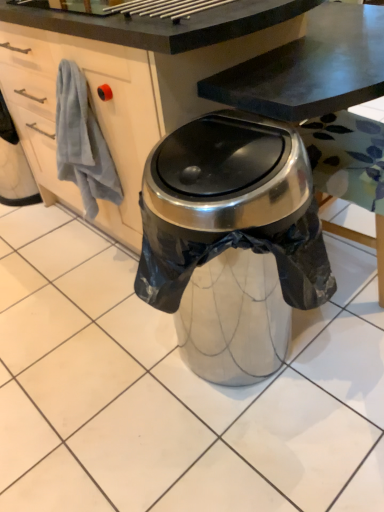
Describe the element at coordinates (174, 390) in the screenshot. I see `metallic trash can at center` at that location.

Identify the location of metallic trash can at center. 174,390.

What do you see at coordinates (94, 109) in the screenshot? Image resolution: width=384 pixels, height=512 pixels. I see `white matte cabinet at left` at bounding box center [94, 109].

The height and width of the screenshot is (512, 384). Find the location of `white matte cabinet at left`. white matte cabinet at left is located at coordinates (94, 109).

You are a GUI agent. You are given a task and a screenshot of the screen. Output one action in this format:
    pyautogui.click(x=<x>, y=<y>)
    Task: Click on the metallic trash can at center
    
    Given the screenshot: What is the action you would take?
    pyautogui.click(x=174, y=390)

Is white matte cabinet at left to the left or to the right of metallic trash can at center in the image?

Based on their positions, white matte cabinet at left is located to the left of metallic trash can at center.

Considering their positions, is white matte cabinet at left located in front of or behind metallic trash can at center?

Visually, white matte cabinet at left is located behind metallic trash can at center.

Does point (47, 113) come farther from viewer compared to point (91, 485)?

Yes, it is behind point (91, 485).

From the image's perspective, does white matte cabinet at left appear higher than metallic trash can at center?

Yes, from the image's perspective, white matte cabinet at left is above metallic trash can at center.

From a real-world perspective, is white matte cabinet at left physically located above or below metallic trash can at center?

white matte cabinet at left is above metallic trash can at center.

Which object is thinner, white matte cabinet at left or metallic trash can at center?

With smaller width is white matte cabinet at left.

Based on the photo, from their relative heights in the image, would you say white matte cabinet at left is taller or shorter than metallic trash can at center?

Considering their sizes, white matte cabinet at left has less height than metallic trash can at center.

Between white matte cabinet at left and metallic trash can at center, which one has larger size?

With larger size is metallic trash can at center.

Is white matte cabinet at left not within metallic trash can at center?

Yes.

Is white matte cabinet at left not close to metallic trash can at center?

No, white matte cabinet at left is not far from metallic trash can at center.

Is white matte cabinet at left oriented towards metallic trash can at center?

No, white matte cabinet at left is not oriented towards metallic trash can at center.

Can you tell me how much white matte cabinet at left and metallic trash can at center differ in facing direction?

The angular difference between white matte cabinet at left and metallic trash can at center is 0.0545 degrees.

In the image, there is a white matte cabinet at left. At what (x,y) coordinates should I click in order to perform the action: click on tile below it (from the image's perspective). Please return your answer as a coordinate pair (x, y). Image resolution: width=384 pixels, height=512 pixels. Looking at the image, I should click on (174, 390).

Which is more to the left, metallic trash can at center or white matte cabinet at left?

white matte cabinet at left is more to the left.

Who is more distant, metallic trash can at center or white matte cabinet at left?

white matte cabinet at left is more distant.

Does point (225, 448) appear closer or farther from the camera than point (103, 101)?

Point (225, 448) is positioned closer to the camera compared to point (103, 101).

From the image's perspective, which object appears higher, metallic trash can at center or white matte cabinet at left?

white matte cabinet at left, from the image's perspective.

From a real-world perspective, is metallic trash can at center positioned under white matte cabinet at left based on gravity?

Yes, from a real-world perspective, metallic trash can at center is below white matte cabinet at left.

Can you confirm if metallic trash can at center is wider than white matte cabinet at left?

Indeed, metallic trash can at center has a greater width compared to white matte cabinet at left.

Who is shorter, metallic trash can at center or white matte cabinet at left?

With less height is white matte cabinet at left.

Considering the sizes of objects metallic trash can at center and white matte cabinet at left in the image provided, who is bigger, metallic trash can at center or white matte cabinet at left?

metallic trash can at center is bigger.

Is white matte cabinet at left located within metallic trash can at center?

No, white matte cabinet at left is not surrounded by metallic trash can at center.

Is metallic trash can at center with white matte cabinet at left?

metallic trash can at center and white matte cabinet at left are clearly separated.

Is metallic trash can at center positioned with its back to white matte cabinet at left?

No, metallic trash can at center is not facing the opposite direction of white matte cabinet at left.

In the scene shown: Can you tell me how much metallic trash can at center and white matte cabinet at left differ in facing direction?

metallic trash can at center and white matte cabinet at left are facing 0.0545 degrees away from each other.

Where is `cabinetry on the left of metallic trash can at center`? cabinetry on the left of metallic trash can at center is located at coordinates (94, 109).

This screenshot has width=384, height=512. In the image, there is a white matte cabinet at left. Find the location of `tile below it (from a real-world perspective)`. tile below it (from a real-world perspective) is located at coordinates (174, 390).

Locate an element on the screen. The height and width of the screenshot is (512, 384). cabinetry behind the metallic trash can at center is located at coordinates (94, 109).